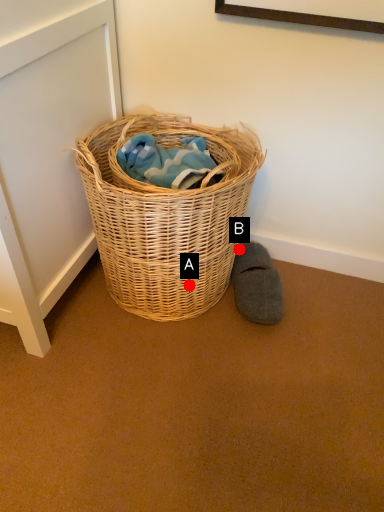
Question: Two points are circled on the image, labeled by A and B beside each circle. Which point is closer to the camera?

Choices:
 (A) A is closer
 (B) B is closer

Answer: (A)